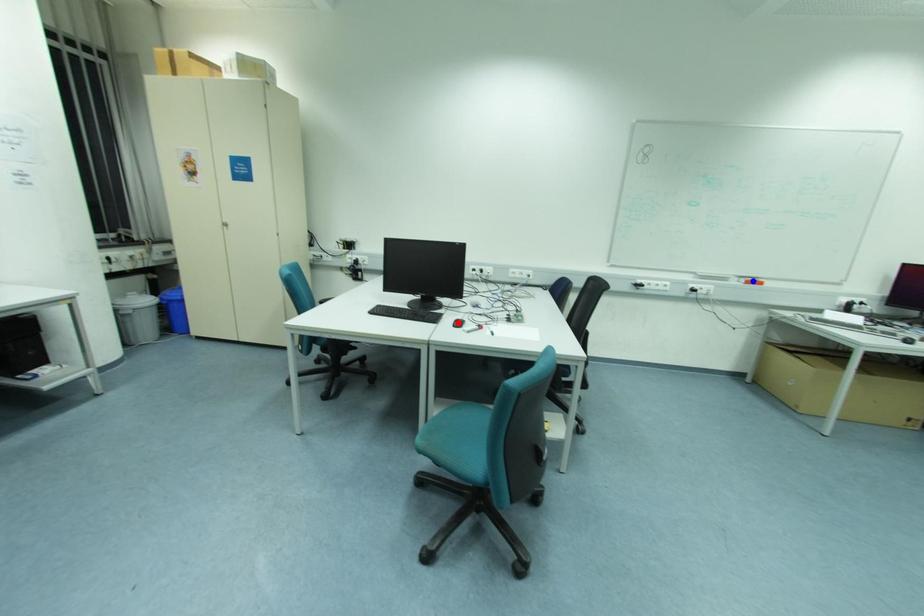
Question: Which of the two points in the image is closer to the camera?

Choices:
 (A) Blue point is closer.
 (B) Red point is closer.

Answer: (B)